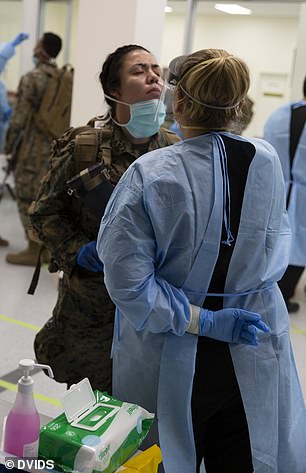
You are a GUI agent. You are given a task and a screenshot of the screen. Output one action in this format:
    pyautogui.click(x=<x>, y=<y>)
    Task: Click on the yellow stripes on floor
    The height and width of the screenshot is (473, 306).
    Given the screenshot: What is the action you would take?
    pyautogui.click(x=27, y=325), pyautogui.click(x=9, y=385), pyautogui.click(x=296, y=328)